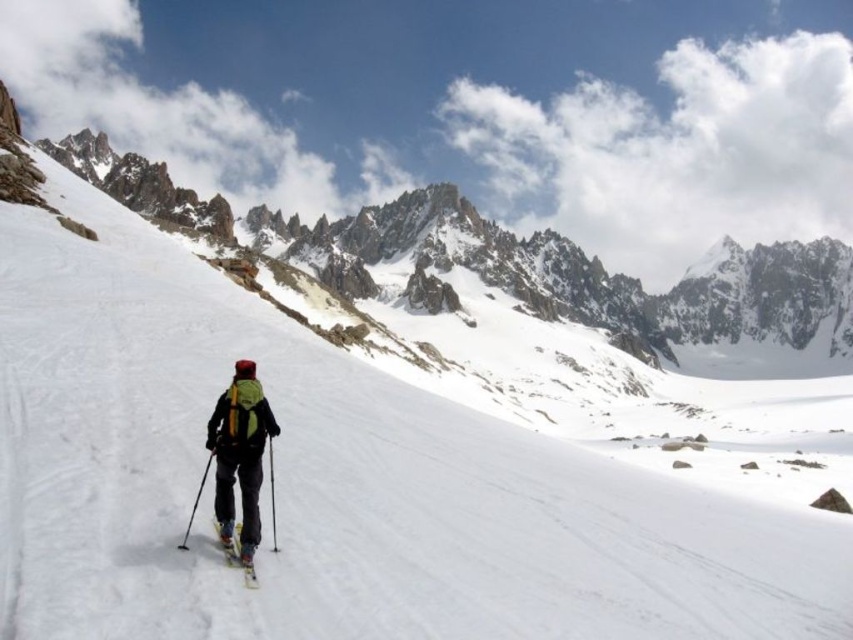
Looking at this image, which is more to the left, black plastic ski pole at center or black plastic ski pole at lower left?

From the viewer's perspective, black plastic ski pole at lower left appears more on the left side.

Does black plastic ski pole at center have a larger size compared to black plastic ski pole at lower left?

Indeed, black plastic ski pole at center has a larger size compared to black plastic ski pole at lower left.

Is point (271, 499) less distant than point (207, 454)?

Yes, point (271, 499) is closer to viewer.

The height and width of the screenshot is (640, 853). I want to click on black plastic ski pole at center, so click(x=271, y=493).

Consider the image. Does matte green backpack at center appear over black plastic ski pole at lower left?

Indeed, matte green backpack at center is positioned over black plastic ski pole at lower left.

Image resolution: width=853 pixels, height=640 pixels. What are the coordinates of `matte green backpack at center` in the screenshot? It's located at (239, 454).

This screenshot has height=640, width=853. I want to click on matte green backpack at center, so click(239, 454).

Is point (230, 545) positioned in front of point (270, 493)?

Yes, it is.

Who is more distant from viewer, (236, 557) or (270, 458)?

The point (270, 458) is behind.

The height and width of the screenshot is (640, 853). What do you see at coordinates (238, 557) in the screenshot?
I see `yellow matte ski at lower center` at bounding box center [238, 557].

You are a GUI agent. You are given a task and a screenshot of the screen. Output one action in this format:
    pyautogui.click(x=<x>, y=<y>)
    Task: Click on the yellow matte ski at lower center
    
    Given the screenshot: What is the action you would take?
    pyautogui.click(x=238, y=557)